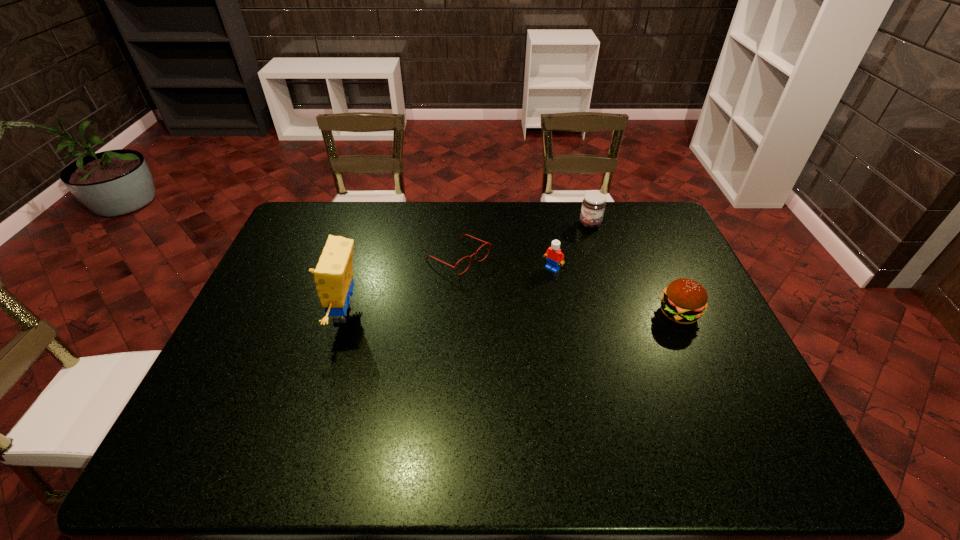
Where is `vacant position located on the face of the leftmost object`? This screenshot has width=960, height=540. vacant position located on the face of the leftmost object is located at coordinates (268, 314).

At what (x,y) coordinates should I click in order to perform the action: click on vacant space located 0.360m on the left of the hamburger. Please return your answer as a coordinate pair (x, y). Image resolution: width=960 pixels, height=540 pixels. Looking at the image, I should click on (532, 314).

The width and height of the screenshot is (960, 540). In order to click on free spot located 0.110m on the face of the second object from left to right in this screenshot , I will do `click(508, 289)`.

Where is `free space located on the face of the second object from left to right`? The width and height of the screenshot is (960, 540). free space located on the face of the second object from left to right is located at coordinates (496, 281).

The width and height of the screenshot is (960, 540). In order to click on free space located 0.280m on the face of the second object from left to right in this screenshot , I will do `click(554, 319)`.

This screenshot has height=540, width=960. I want to click on vacant space situated 0.080m on the front label of the jam, so click(x=579, y=242).

This screenshot has width=960, height=540. Identify the location of free location located 0.220m on the front label of the jam. (564, 266).

Find the location of `vacant space located 0.230m on the front label of the jam`. vacant space located 0.230m on the front label of the jam is located at coordinates (563, 268).

You are a GUI agent. You are given a task and a screenshot of the screen. Output one action in this format:
    pyautogui.click(x=<x>, y=<y>)
    Task: Click on the free location located on the face of the Lego
    
    Given the screenshot: What is the action you would take?
    pyautogui.click(x=523, y=295)

Find the location of `free location located 0.070m on the face of the Lego`. free location located 0.070m on the face of the Lego is located at coordinates (535, 285).